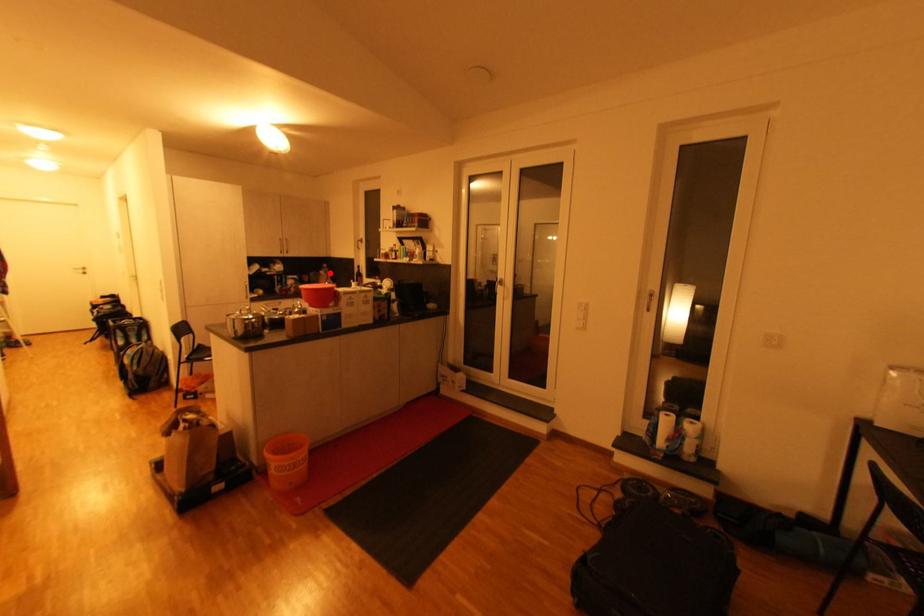
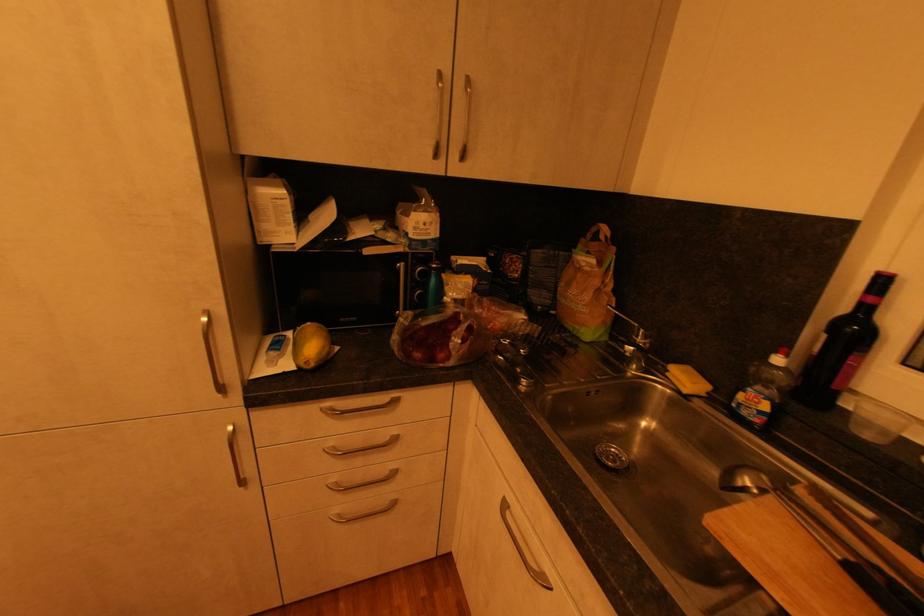
Question: I am providing you with two images of the same scene from different viewpoints. In image1, a red point is highlighted. Considering the same 3D point in image2, which of the following is correct?

Choices:
 (A) It is closer
 (B) It is farther

Answer: (A)